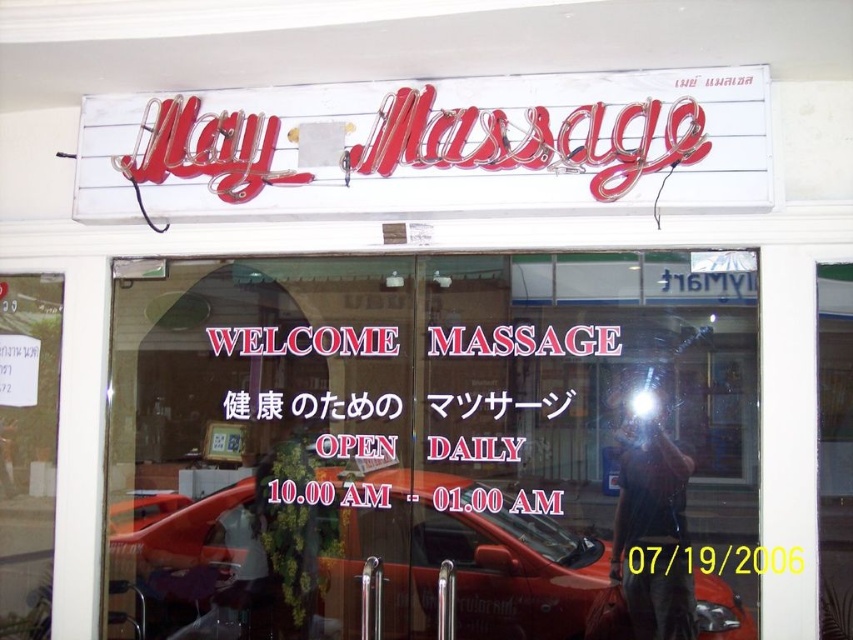
You are standing in front of the massage parlor and want to touch the point at coordinate point (505, 93). Can you reach it without moving your position?

The point at coordinate point (505, 93) is 8.02 feet away from the camera, so you cannot reach it without moving your position because it is too far.

You are standing outside the massage parlor and notice both the neon red sign at upper center and the shiny red car at center. Which object appears taller in the reflection on the glass doors?

The neon red sign at upper center has a lesser height compared to the shiny red car at center, so the shiny red car at center appears taller in the reflection on the glass doors.